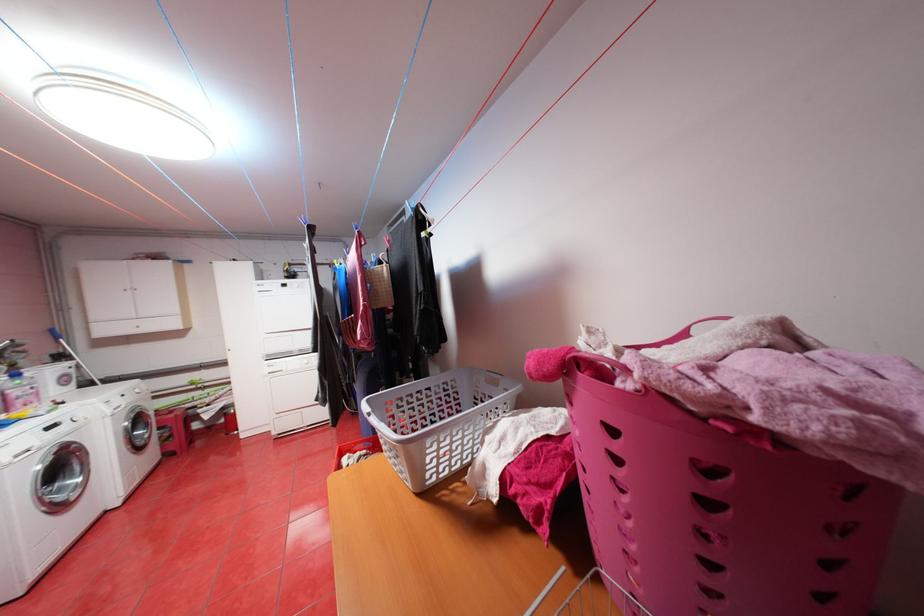
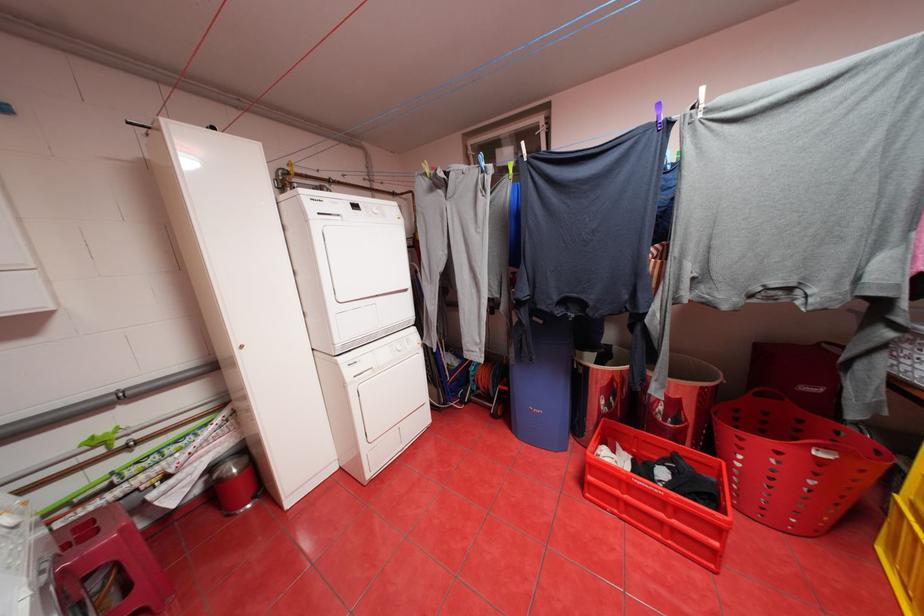
What movement of the cameraman would produce the second image?

The cameraman moved toward left, forward.